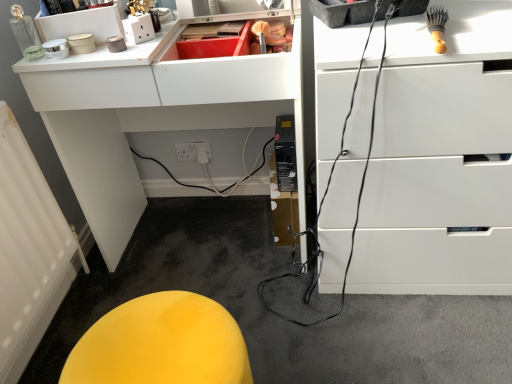
Question: Can you confirm if yellow fabric stool at lower left is thinner than white glossy computer desk at upper center?

Choices:
 (A) no
 (B) yes

Answer: (B)

Question: Can you confirm if yellow fabric stool at lower left is smaller than white glossy computer desk at upper center?

Choices:
 (A) no
 (B) yes

Answer: (B)

Question: Is yellow fabric stool at lower left bigger than white glossy computer desk at upper center?

Choices:
 (A) no
 (B) yes

Answer: (A)

Question: Is yellow fabric stool at lower left outside of white glossy computer desk at upper center?

Choices:
 (A) no
 (B) yes

Answer: (B)

Question: Is yellow fabric stool at lower left closer to camera compared to white glossy computer desk at upper center?

Choices:
 (A) no
 (B) yes

Answer: (B)

Question: From their relative heights in the image, would you say white glossy chest of drawers at upper right is taller or shorter than yellow fabric stool at lower left?

Choices:
 (A) tall
 (B) short

Answer: (A)

Question: Is white glossy chest of drawers at upper right in front of or behind yellow fabric stool at lower left in the image?

Choices:
 (A) behind
 (B) front

Answer: (A)

Question: From the image's perspective, is white glossy chest of drawers at upper right positioned above or below yellow fabric stool at lower left?

Choices:
 (A) below
 (B) above

Answer: (B)

Question: Based on their positions, is white glossy chest of drawers at upper right located to the left or right of yellow fabric stool at lower left?

Choices:
 (A) right
 (B) left

Answer: (A)

Question: From a real-world perspective, is yellow fabric stool at lower left positioned above or below white textured radiator at lower left?

Choices:
 (A) below
 (B) above

Answer: (B)

Question: From their relative heights in the image, would you say yellow fabric stool at lower left is taller or shorter than white textured radiator at lower left?

Choices:
 (A) tall
 (B) short

Answer: (A)

Question: Looking at their shapes, would you say yellow fabric stool at lower left is wider or thinner than white textured radiator at lower left?

Choices:
 (A) wide
 (B) thin

Answer: (A)

Question: Is point (159, 375) positioned closer to the camera than point (2, 117)?

Choices:
 (A) farther
 (B) closer

Answer: (B)

Question: Is point (333, 124) closer or farther from the camera than point (108, 210)?

Choices:
 (A) farther
 (B) closer

Answer: (B)

Question: Considering their positions, is white glossy chest of drawers at upper right located in front of or behind white glossy computer desk at upper center?

Choices:
 (A) front
 (B) behind

Answer: (A)